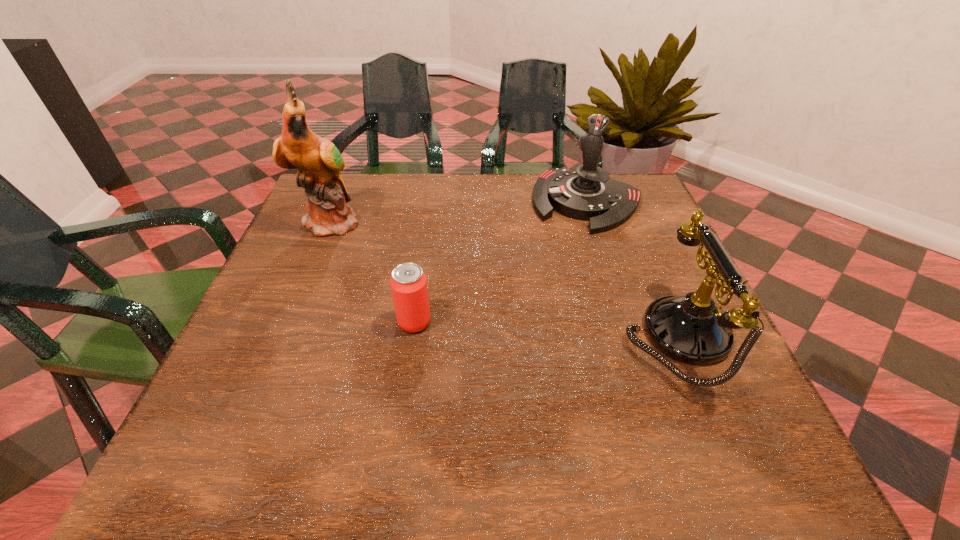
The height and width of the screenshot is (540, 960). Identify the location of vacant space on the desktop that is between the second object from left to right and the telephone and is positioned on the front-facing side of the tallest object. (533, 329).

Image resolution: width=960 pixels, height=540 pixels. Find the location of `free spot on the desktop that is between the beer can and the telephone and is positioned on the handle side of the joystick`. free spot on the desktop that is between the beer can and the telephone and is positioned on the handle side of the joystick is located at coordinates (515, 328).